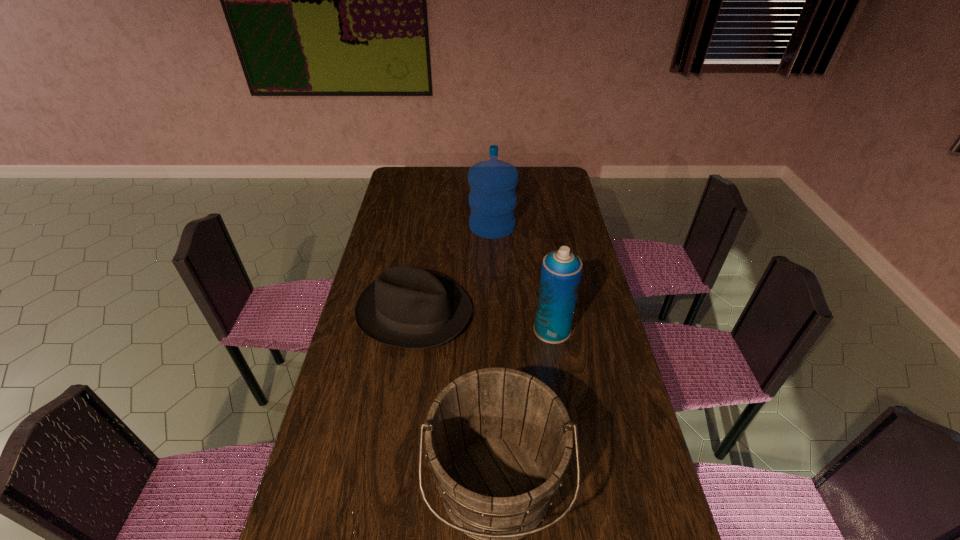
This screenshot has width=960, height=540. In order to click on the farthest object in this screenshot , I will do `click(492, 198)`.

In order to click on aerosol can in this screenshot , I will do `click(561, 270)`.

Find the location of a particular element. This screenshot has width=960, height=540. the shortest object is located at coordinates pyautogui.click(x=406, y=306).

At what (x,y) coordinates should I click in order to perform the action: click on vacant space situated on the back of the water jug. Please return your answer as a coordinate pair (x, y). Image resolution: width=960 pixels, height=540 pixels. Looking at the image, I should click on (491, 171).

At what (x,y) coordinates should I click in order to perform the action: click on free spot located on the right of the aerosol can. Please return your answer as a coordinate pair (x, y). The height and width of the screenshot is (540, 960). Looking at the image, I should click on (592, 329).

Locate an element on the screen. This screenshot has width=960, height=540. vacant space situated on the back of the shortest object is located at coordinates (429, 217).

This screenshot has width=960, height=540. Identify the location of object that is at the left edge. (406, 306).

Locate an element on the screen. This screenshot has height=540, width=960. object located in the right edge section of the desktop is located at coordinates (561, 270).

Find the location of a particular element. This screenshot has width=960, height=540. vacant area at the far edge is located at coordinates (450, 179).

The image size is (960, 540). I want to click on vacant space at the left edge, so click(x=408, y=193).